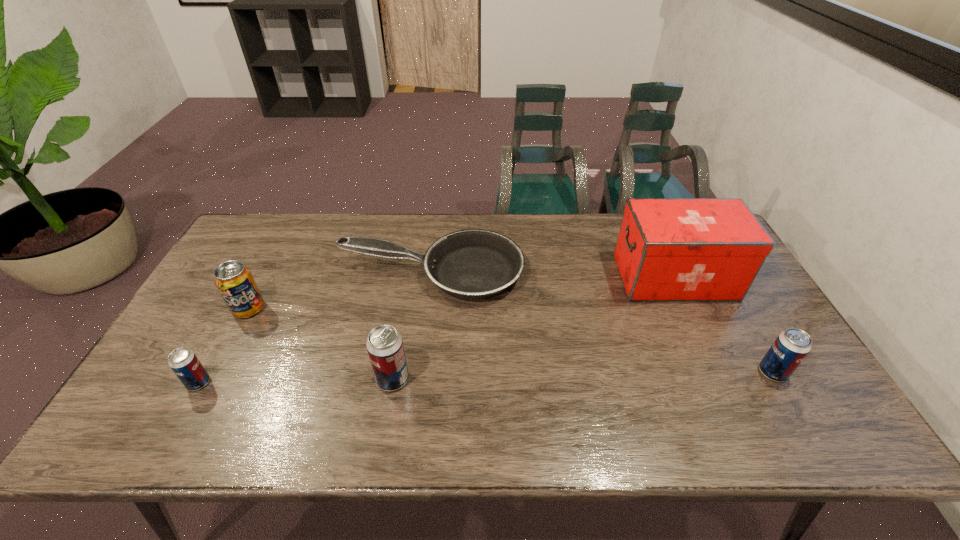
The height and width of the screenshot is (540, 960). I want to click on beer can identified as the second closest to the tallest beer can, so click(791, 346).

The width and height of the screenshot is (960, 540). Identify the location of vacant space that satisfies the following two spatial constraints: 1. on the back side of the fifth tallest object; 2. on the right side of the tallest beer can. (201, 379).

The height and width of the screenshot is (540, 960). Find the location of `vacant space that satisfies the following two spatial constraints: 1. on the handle side of the first-aid kit; 2. on the left side of the second tallest beer can`. vacant space that satisfies the following two spatial constraints: 1. on the handle side of the first-aid kit; 2. on the left side of the second tallest beer can is located at coordinates (719, 372).

Where is `vacant space that satisfies the following two spatial constraints: 1. on the handle side of the first-aid kit; 2. on the front side of the soda can`? This screenshot has height=540, width=960. vacant space that satisfies the following two spatial constraints: 1. on the handle side of the first-aid kit; 2. on the front side of the soda can is located at coordinates (689, 309).

The image size is (960, 540). What are the coordinates of `blank area in the image that satisfies the following two spatial constraints: 1. on the back side of the second tallest beer can; 2. on the handle side of the tallest object` in the screenshot? It's located at (718, 277).

At what (x,y) coordinates should I click in order to perform the action: click on blank area in the image that satisfies the following two spatial constraints: 1. on the handle side of the first-aid kit; 2. on the front side of the tallest beer can. Please return your answer as a coordinate pair (x, y). Looking at the image, I should click on (722, 379).